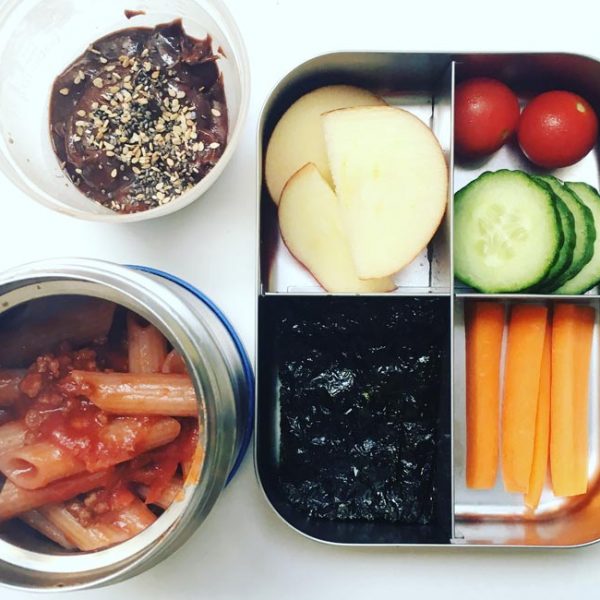
This screenshot has width=600, height=600. I want to click on countertop, so click(268, 44).